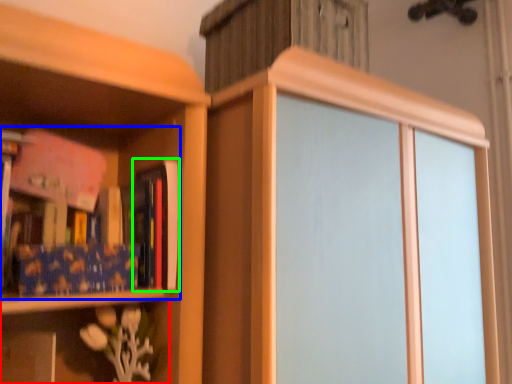
Question: Estimate the real-world distances between objects in this image. Which object is farther from shelf (highlighted by a red box), book (highlighted by a blue box) or book (highlighted by a green box)?

Choices:
 (A) book
 (B) book

Answer: (B)